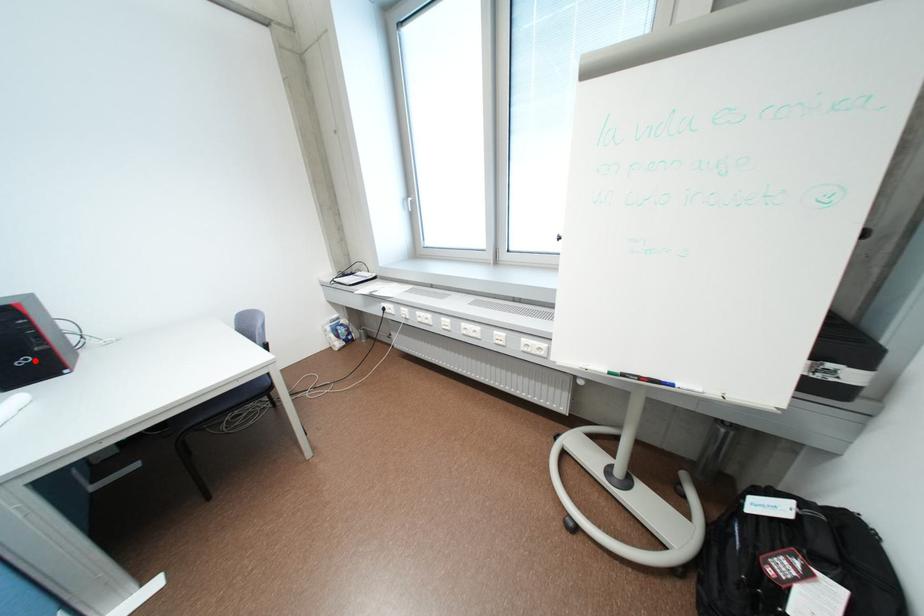
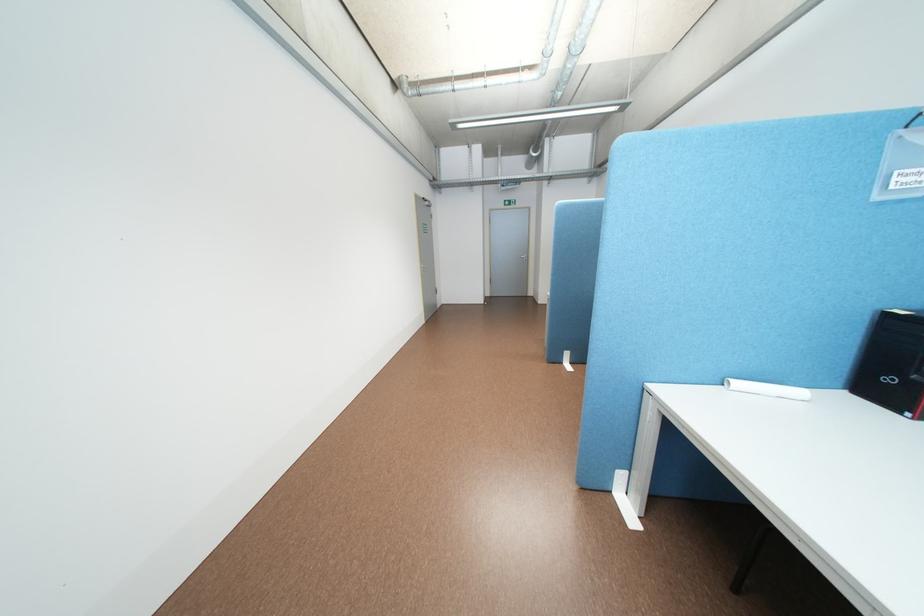
Question: I am providing you with two images of the same scene from different viewpoints. In image1, a red point is highlighted. Considering the same 3D point in image2, which of the following is correct?

Choices:
 (A) It is closer
 (B) It is farther

Answer: (A)